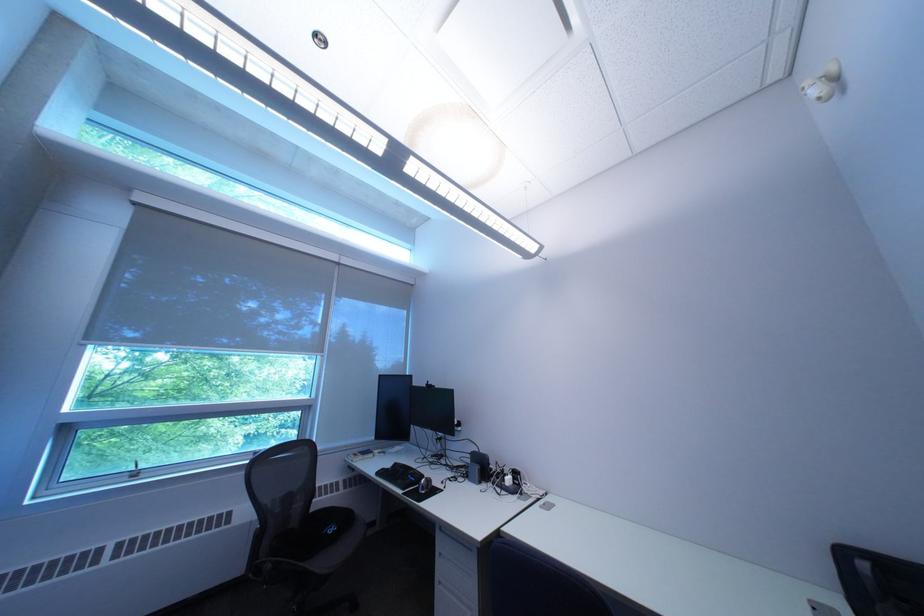
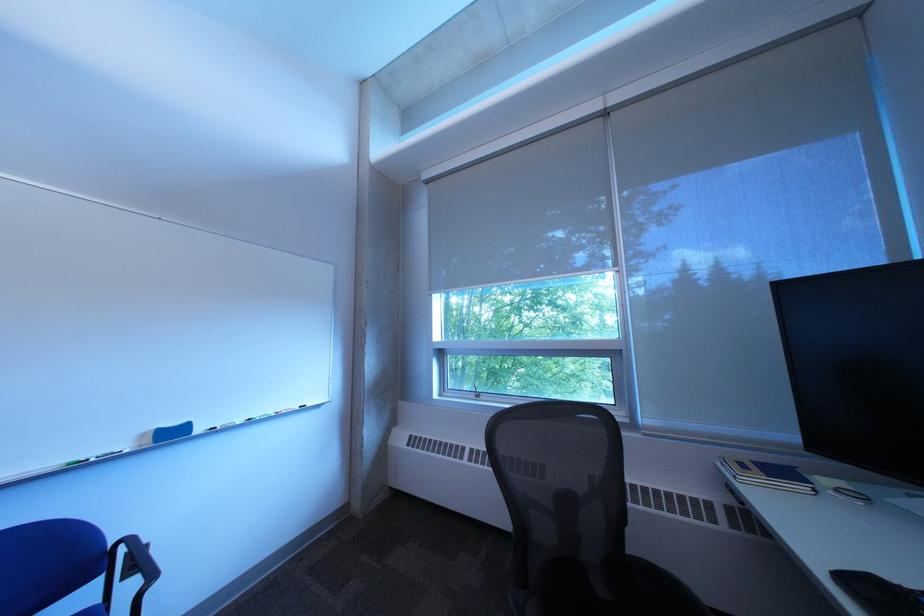
In the second image, find the point that corresponds to [280,317] in the first image.

(611, 267)